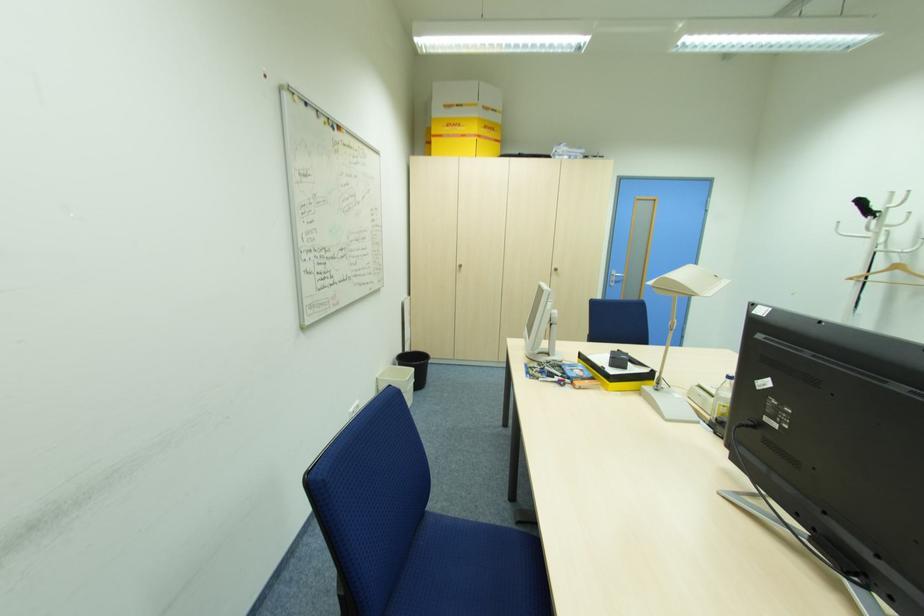
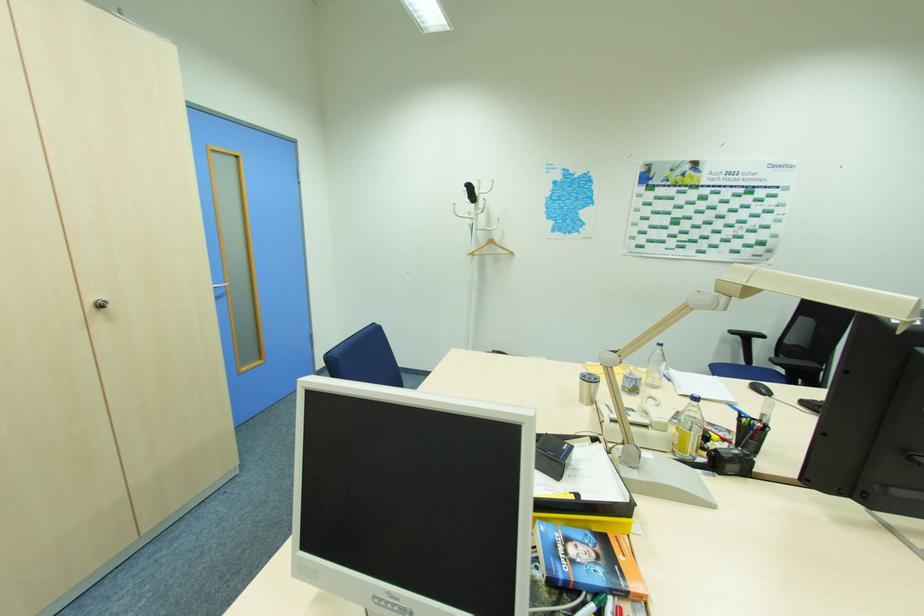
Where in the second image is the point corresponding to [881,212] from the first image?

(479, 197)